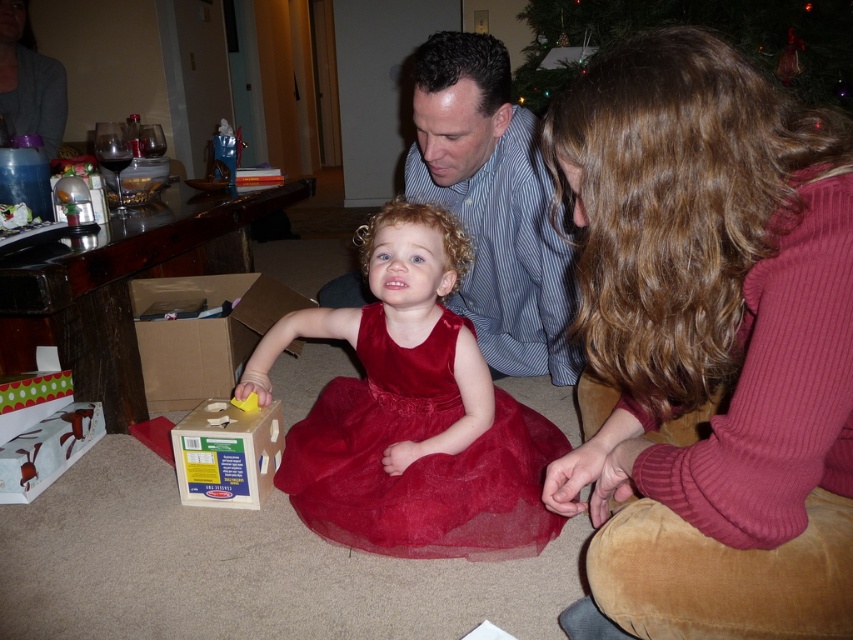
You are standing in the living room and see two points marked in the scene. Which point, point (252, 426) or point (18, 476), is closer to you?

Point (252, 426) is closer to the viewer than point (18, 476).